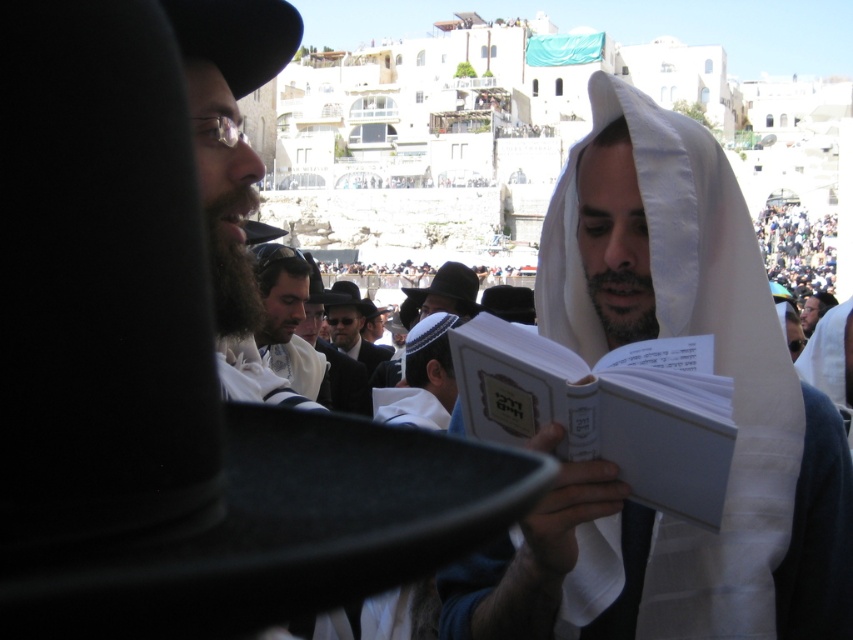
Can you confirm if white paper book at center is positioned below dark gray clothing at upper right?

Correct, white paper book at center is located below dark gray clothing at upper right.

Is point (726, 406) in front of point (820, 240)?

Yes, it is.

Between point (708, 504) and point (815, 224), which one is positioned in front?

Point (708, 504)

Locate an element on the screen. The width and height of the screenshot is (853, 640). white paper book at center is located at coordinates (601, 413).

Who is higher up, white cloth at center or matte black suit at center?

Positioned higher is matte black suit at center.

At what (x,y) coordinates should I click in order to perform the action: click on white cloth at center. Please return your answer as a coordinate pair (x, y). Looking at the image, I should click on (715, 371).

Is dark gray clothing at upper right behind matte black suit at center?

That is True.

Between point (782, 237) and point (339, 339), which one is positioned behind?

Positioned behind is point (782, 237).

Who is more forward, (787,244) or (334,323)?

Point (334,323) is more forward.

Where is `dark gray clothing at upper right`? This screenshot has height=640, width=853. dark gray clothing at upper right is located at coordinates (798, 248).